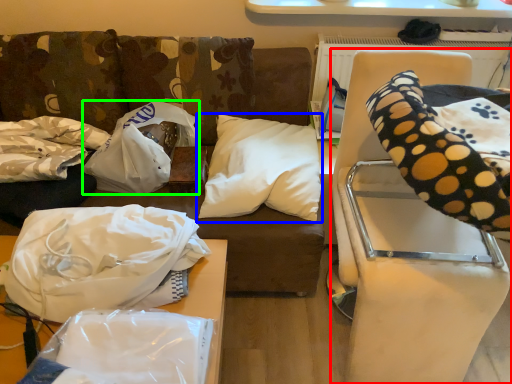
Question: Considering the real-world distances, which object is closest to furniture (highlighted by a red box)? pillow (highlighted by a blue box) or material (highlighted by a green box).

Choices:
 (A) pillow
 (B) material

Answer: (A)